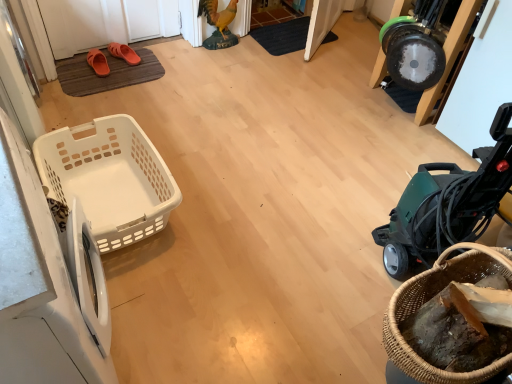
At what (x,y) coordinates should I click in order to perform the action: click on vacant space that is in between green plastic vacuum cleaner at right and black textured doormat at center, marked as the 1th doormat in a back-to-front arrangement. Please return your answer as a coordinate pair (x, y). The height and width of the screenshot is (384, 512). Looking at the image, I should click on (333, 120).